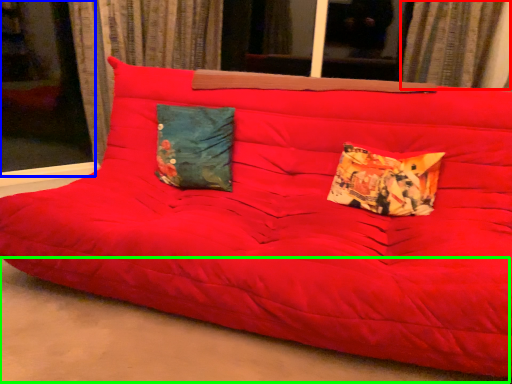
Question: Based on their relative distances, which object is nearer to curtain (highlighted by a red box)? Choose from window (highlighted by a blue box) and concrete (highlighted by a green box).

Choices:
 (A) window
 (B) concrete

Answer: (B)